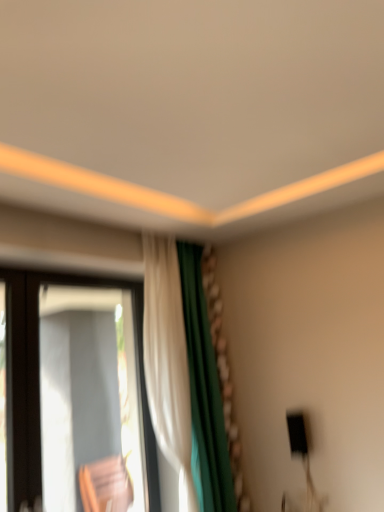
Question: Is transparent glass window at left shorter than white fabric curtain at center?

Choices:
 (A) yes
 (B) no

Answer: (A)

Question: From a real-world perspective, is transparent glass window at left physically above white fabric curtain at center?

Choices:
 (A) yes
 (B) no

Answer: (B)

Question: Is transparent glass window at left far from white fabric curtain at center?

Choices:
 (A) no
 (B) yes

Answer: (A)

Question: Is transparent glass window at left facing away from white fabric curtain at center?

Choices:
 (A) yes
 (B) no

Answer: (B)

Question: Is transparent glass window at left wider than white fabric curtain at center?

Choices:
 (A) yes
 (B) no

Answer: (B)

Question: Can you see transparent glass window at left touching white fabric curtain at center?

Choices:
 (A) yes
 (B) no

Answer: (B)

Question: Is white fabric curtain at center outside of transparent glass window at left?

Choices:
 (A) yes
 (B) no

Answer: (A)

Question: Can you confirm if white fabric curtain at center is wider than transparent glass window at left?

Choices:
 (A) no
 (B) yes

Answer: (B)

Question: Is white fabric curtain at center shorter than transparent glass window at left?

Choices:
 (A) yes
 (B) no

Answer: (B)

Question: Is white fabric curtain at center closer to the viewer compared to transparent glass window at left?

Choices:
 (A) yes
 (B) no

Answer: (B)

Question: Is white fabric curtain at center at the left side of transparent glass window at left?

Choices:
 (A) no
 (B) yes

Answer: (A)

Question: Can you confirm if white fabric curtain at center is thinner than transparent glass window at left?

Choices:
 (A) no
 (B) yes

Answer: (A)

Question: From a real-world perspective, is transparent glass window at left positioned above or below white fabric curtain at center?

Choices:
 (A) below
 (B) above

Answer: (A)